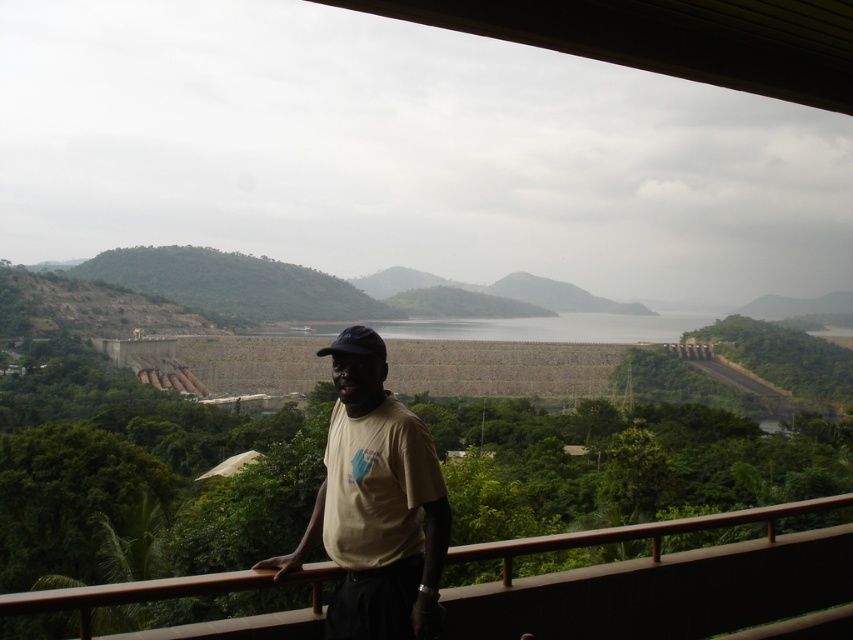
Who is positioned more to the right, beige cotton t-shirt at center or brown wooden railing at lower center?

Positioned to the right is beige cotton t-shirt at center.

Does beige cotton t-shirt at center have a lesser height compared to brown wooden railing at lower center?

Correct, beige cotton t-shirt at center is not as tall as brown wooden railing at lower center.

Is point (368, 339) more distant than point (84, 602)?

Yes, point (368, 339) is behind point (84, 602).

The width and height of the screenshot is (853, 640). I want to click on beige cotton t-shirt at center, so click(x=376, y=504).